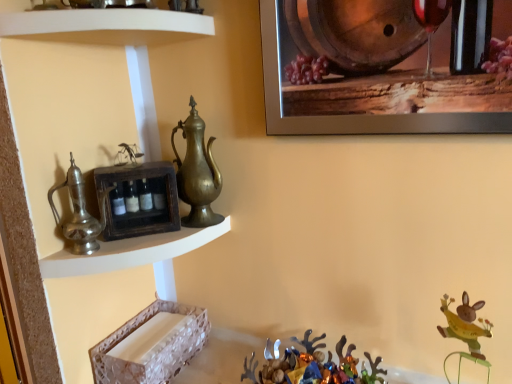
The image size is (512, 384). I want to click on vacant space to the right of brushed metal jug at left, placed as the first jug when sorted from front to back, so click(x=143, y=244).